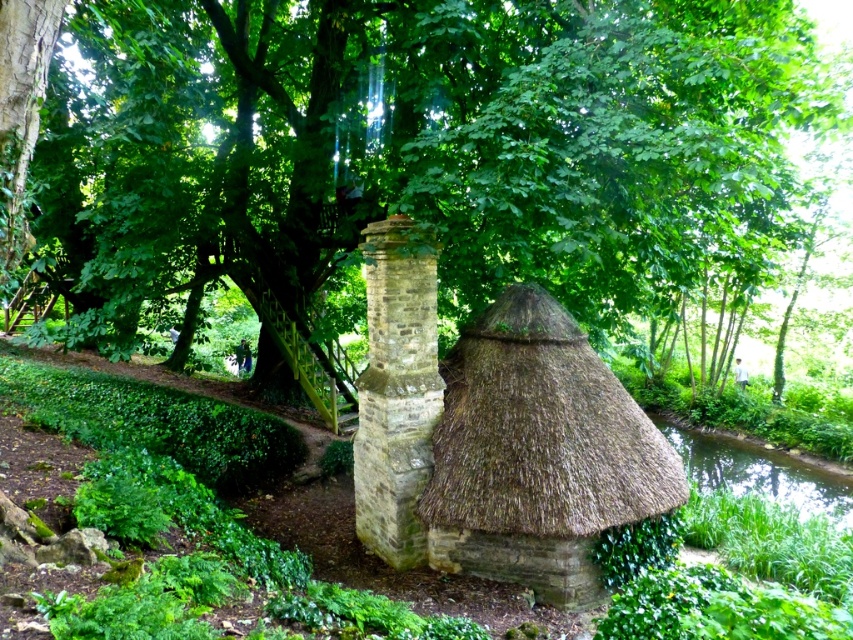
You are planning to take a photo of the brown thatch roof at center and the green leafy tree at center from a distance. Which object will appear wider in the photo?

The green leafy tree at center will appear wider in the photo because its width surpasses that of the brown thatch roof at center.

You are standing at the entrance of the rustic stone building with a conical thatched roof. You want to walk directly towards the green leafy tree at center. Which direction should you head?

Since the green leafy tree at center is located at coordinates approximately 0.231 on the x axis and 0.495 on the y axis, you should head towards the center of the image where the tree is positioned.

You are standing on the green grassy bank at lower right and want to walk to the brown thatch roof at center. Which direction should you head?

You should head to the left because the brown thatch roof at center is positioned on the left side of the green grassy bank at lower right.